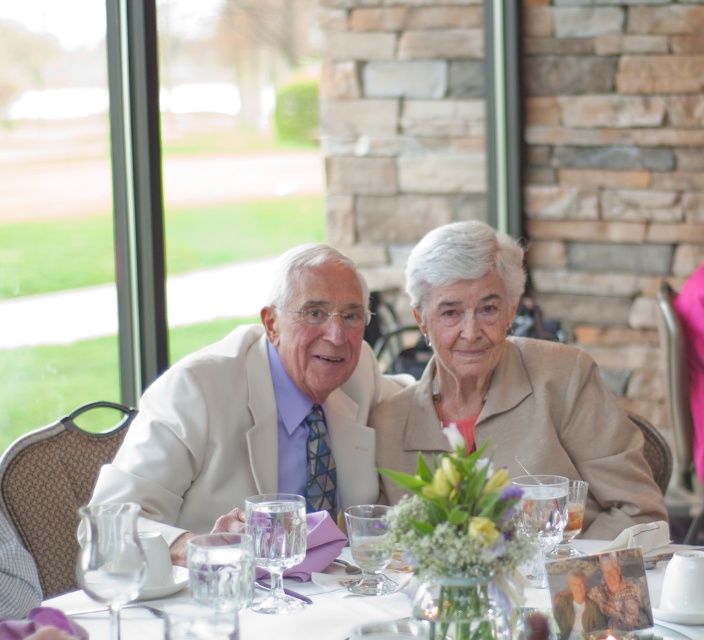
Based on the photo, who is positioned more to the right, white fabric suit at center or beige fabric jacket at center?

beige fabric jacket at center is more to the right.

Which is in front, point (213, 444) or point (505, 356)?

Positioned in front is point (213, 444).

Where is `white fabric suit at center`? white fabric suit at center is located at coordinates (260, 410).

Who is more forward, (386,400) or (310,582)?

Positioned in front is point (310,582).

Based on the photo, who is higher up, beige fabric jacket at center or white porcelain plate at lower center?

beige fabric jacket at center

Is point (653, 488) behind point (308, 621)?

That is True.

I want to click on beige fabric jacket at center, so (x=508, y=385).

Is point (220, 403) in front of point (308, 588)?

That is False.

Does point (150, 474) lie in front of point (685, 636)?

No, it is not.

You are a GUI agent. You are given a task and a screenshot of the screen. Output one action in this format:
    pyautogui.click(x=<x>, y=<y>)
    Task: Click on the white fabric suit at center
    Image resolution: width=704 pixels, height=640 pixels.
    Given the screenshot: What is the action you would take?
    pyautogui.click(x=260, y=410)